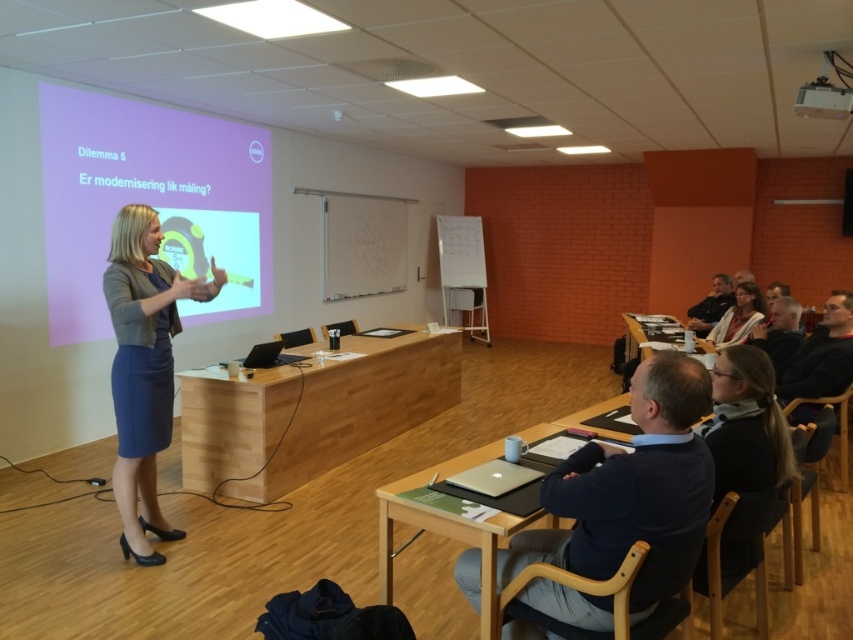
Question: Among these points, which one is farthest from the camera?

Choices:
 (A) (646, 392)
 (B) (701, 316)

Answer: (B)

Question: Is dark blue shirt at center thinner than dark brown leather jacket at upper right?

Choices:
 (A) no
 (B) yes

Answer: (A)

Question: Is matte white projector screen at upper left further to camera compared to matte beige sweater at upper right?

Choices:
 (A) no
 (B) yes

Answer: (A)

Question: Which of the following is the closest to the observer?

Choices:
 (A) white plastic projector at upper right
 (B) gray hair at upper right
 (C) matte white projector screen at upper left

Answer: (A)

Question: Does matte beige sweater at upper right appear on the right side of dark brown leather jacket at upper right?

Choices:
 (A) no
 (B) yes

Answer: (A)

Question: Which of the following is the farthest from the observer?

Choices:
 (A) matte white projector screen at upper left
 (B) dark blue shirt at center

Answer: (A)